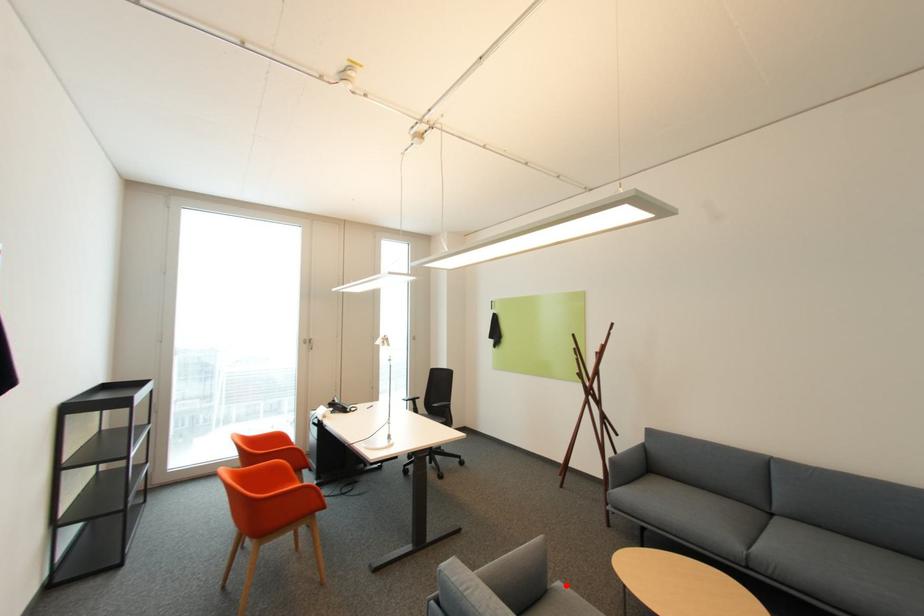
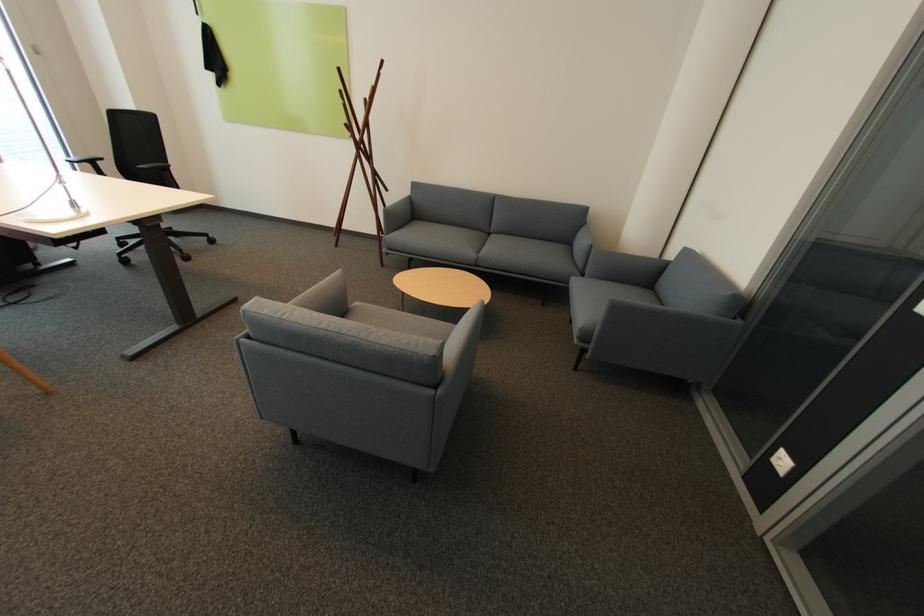
In the second image, find the point that corresponds to the highlighted location in the first image.

(362, 304)